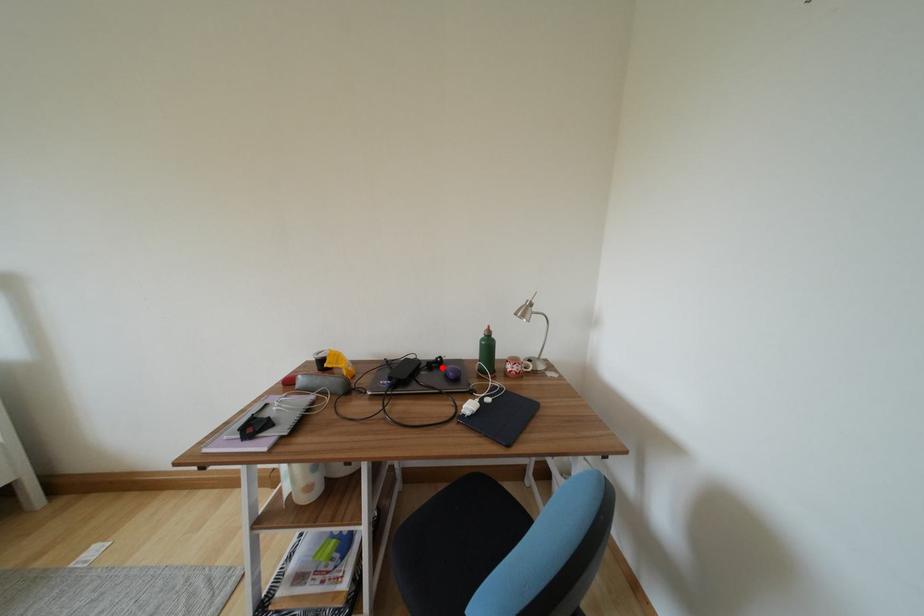
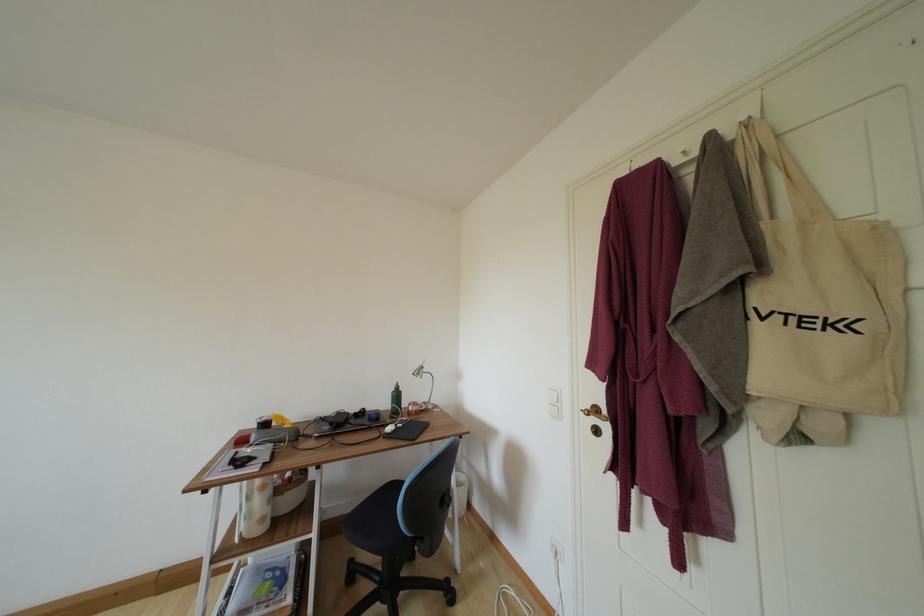
Question: I am providing you with two images of the same scene from different viewpoints. In image1, a red point is highlighted. Considering the same 3D point in image2, which of the following is correct?

Choices:
 (A) It is closer
 (B) It is farther

Answer: (B)